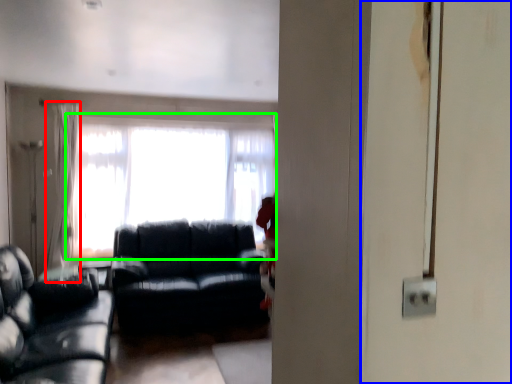
Question: Based on their relative distances, which object is nearer to curtain (highlighted by a red box)? Choose from screen door (highlighted by a blue box) and window (highlighted by a green box).

Choices:
 (A) screen door
 (B) window

Answer: (B)